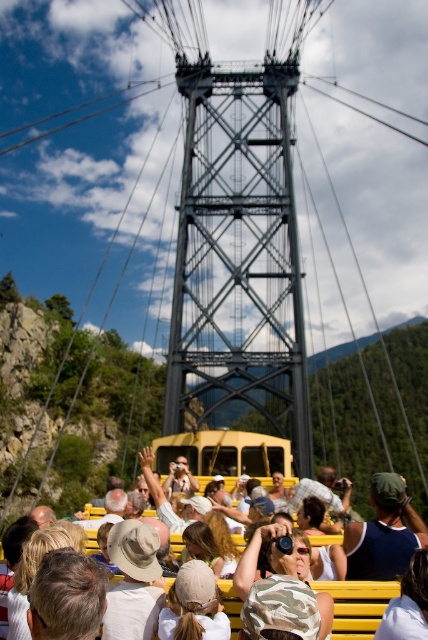
Identify the location of metallic gray bridge at center. (237, 257).

Is metallic gray bridge at center further to camera compared to yellow plastic bench at lower center?

Yes, it is.

Describe the element at coordinates (237, 257) in the screenshot. I see `metallic gray bridge at center` at that location.

You are a GUI agent. You are given a task and a screenshot of the screen. Output one action in this format:
    pyautogui.click(x=<x>, y=<y>)
    Task: Click on the metallic gray bridge at center
    The height and width of the screenshot is (640, 428).
    Given the screenshot: What is the action you would take?
    pyautogui.click(x=237, y=257)

Does point (282, 346) come behind point (50, 634)?

Yes, point (282, 346) is behind point (50, 634).

Which is above, metallic gray bridge at center or light brown hair at center?

metallic gray bridge at center is higher up.

Is point (216, 285) positioned behind point (56, 573)?

Yes.

You are a GUI agent. You are given a task and a screenshot of the screen. Output one action in this format:
    pyautogui.click(x=<x>, y=<y>)
    Task: Click on the metallic gray bridge at center
    The height and width of the screenshot is (640, 428).
    Given the screenshot: What is the action you would take?
    click(x=237, y=257)

Is point (77, 560) positioned before point (389, 612)?

No.

Between point (77, 609) and point (404, 602), which one is positioned in front?

Point (77, 609) is more forward.

Is point (95, 563) positioned in front of point (425, 582)?

No, (95, 563) is behind (425, 582).

The width and height of the screenshot is (428, 640). In order to click on light brown hair at center in this screenshot , I will do `click(67, 596)`.